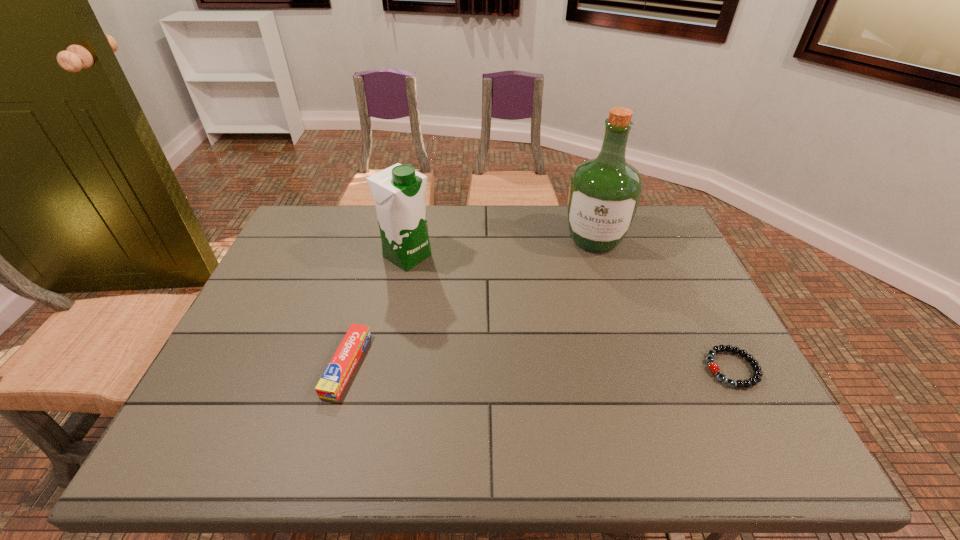
Where is `object located in the far right corner section of the desktop`? The width and height of the screenshot is (960, 540). object located in the far right corner section of the desktop is located at coordinates (604, 193).

The width and height of the screenshot is (960, 540). I want to click on object that is positioned at the near right corner, so click(713, 367).

In the image, there is a desktop. What are the coordinates of `vacant space at the far edge` in the screenshot? It's located at coord(561,219).

Locate an element on the screen. The image size is (960, 540). vacant space at the near edge of the desktop is located at coordinates (616, 383).

In the image, there is a desktop. Find the location of `vacant area at the left edge`. vacant area at the left edge is located at coordinates [324, 250].

This screenshot has width=960, height=540. Find the location of `vacant space at the right edge of the desktop`. vacant space at the right edge of the desktop is located at coordinates tap(722, 363).

In the image, there is a desktop. Where is `vacant space at the far left corner`? Image resolution: width=960 pixels, height=540 pixels. vacant space at the far left corner is located at coordinates (284, 240).

Where is `free region at the far right corner`? This screenshot has width=960, height=540. free region at the far right corner is located at coordinates (651, 211).

At what (x,y) coordinates should I click in order to perform the action: click on vacant point at the near right corner. Please return your answer as a coordinate pair (x, y). The width and height of the screenshot is (960, 540). Looking at the image, I should click on (690, 387).

Locate an element on the screen. Image resolution: width=960 pixels, height=540 pixels. free space between the toothpaste and the shortest object is located at coordinates (540, 366).